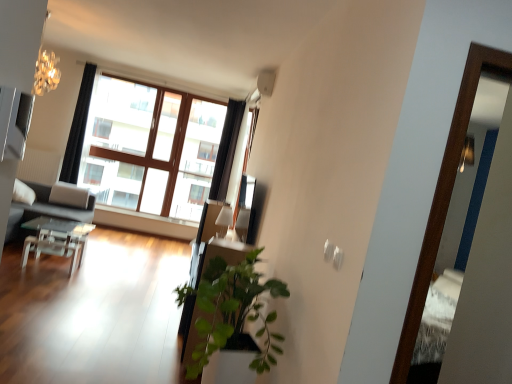
Locate an element on the screen. black fabric curtain at upper left, the 2th curtain positioned from the right is located at coordinates (x=78, y=127).

Identify the location of wooden screen door at right. The image size is (512, 384). (443, 198).

Where is `green leafy plant at center`? This screenshot has width=512, height=384. green leafy plant at center is located at coordinates (232, 312).

Image resolution: width=512 pixels, height=384 pixels. What do you see at coordinates (144, 222) in the screenshot?
I see `white painted wood at center` at bounding box center [144, 222].

The image size is (512, 384). What do you see at coordinates (148, 137) in the screenshot? I see `wooden window at center` at bounding box center [148, 137].

The image size is (512, 384). What do you see at coordinates (226, 150) in the screenshot?
I see `black fabric curtain at upper center, placed as the first curtain when sorted from right to left` at bounding box center [226, 150].

Find the location of a particular element. The image size is (512, 384). black fabric curtain at upper left, which appears as the 1th curtain when viewed from the left is located at coordinates (78, 127).

Which of these two, green leafy plant at center or wooden window at center, is thinner?

wooden window at center is thinner.

This screenshot has width=512, height=384. Find the location of `houseplant in front of the wooden window at center`. houseplant in front of the wooden window at center is located at coordinates (232, 312).

From the image's perspective, is green leafy plant at center located beneath wooden window at center?

Yes.

Is green leafy plant at center facing away from wooden window at center?

No, green leafy plant at center's orientation is not away from wooden window at center.

Are black fabric curtain at upper left, which appears as the 1th curtain when viewed from the left, and white painted wood at center far apart?

black fabric curtain at upper left, which appears as the 1th curtain when viewed from the left, is positioned a significant distance from white painted wood at center.

Considering their positions, is black fabric curtain at upper left, which appears as the 1th curtain when viewed from the left, located in front of or behind white painted wood at center?

black fabric curtain at upper left, which appears as the 1th curtain when viewed from the left, is positioned closer to the viewer than white painted wood at center.

Considering the relative sizes of black fabric curtain at upper left, the 2th curtain positioned from the right, and white painted wood at center in the image provided, is black fabric curtain at upper left, the 2th curtain positioned from the right, bigger than white painted wood at center?

Indeed, black fabric curtain at upper left, the 2th curtain positioned from the right, has a larger size compared to white painted wood at center.

Is black fabric curtain at upper left, the 2th curtain positioned from the right, surrounding white painted wood at center?

No, white painted wood at center is not surrounded by black fabric curtain at upper left, the 2th curtain positioned from the right.

Is green leafy plant at center at the left side of transparent glass table at lower left?

No, green leafy plant at center is not to the left of transparent glass table at lower left.

Which object is wider, green leafy plant at center or transparent glass table at lower left?

green leafy plant at center is wider.

From the image's perspective, between green leafy plant at center and transparent glass table at lower left, who is located below?

From the image's view, green leafy plant at center is below.

From a real-world perspective, which is physically above, green leafy plant at center or transparent glass table at lower left?

In real-world perspective, green leafy plant at center is above.

Which object is wider, wooden window at center or white painted wood at center?

With larger width is wooden window at center.

Is wooden window at center positioned with its back to white painted wood at center?

No.

Is wooden window at center shorter than white painted wood at center?

No, wooden window at center is not shorter than white painted wood at center.

Is wooden screen door at right wider than wooden window at center?

Incorrect, the width of wooden screen door at right does not surpass that of wooden window at center.

Is point (411, 347) positioned after point (120, 158)?

No, it is not.

How different are the orientations of wooden screen door at right and wooden window at center in degrees?

They differ by 2.53 degrees in their facing directions.

Is wooden screen door at right positioned with its back to wooden window at center?

wooden screen door at right does not have its back to wooden window at center.

From the image's perspective, relative to green leafy plant at center, is wooden window at center above or below?

From the image's perspective, wooden window at center appears above green leafy plant at center.

Is green leafy plant at center at the back of wooden window at center?

No, wooden window at center is not facing away from green leafy plant at center.

Based on the photo, considering the sizes of wooden window at center and green leafy plant at center in the image, is wooden window at center taller or shorter than green leafy plant at center?

In the image, wooden window at center appears to be taller than green leafy plant at center.

Looking at the image, does wooden window at center seem bigger or smaller compared to green leafy plant at center?

Clearly, wooden window at center is larger in size than green leafy plant at center.

Considering the sizes of objects matte gray couch at left and green leafy plant at center in the image provided, who is shorter, matte gray couch at left or green leafy plant at center?

matte gray couch at left.

From a real-world perspective, is matte gray couch at left on top of green leafy plant at center?

Incorrect, from a real-world perspective, matte gray couch at left is lower than green leafy plant at center.

Is matte gray couch at left touching green leafy plant at center?

matte gray couch at left is not next to green leafy plant at center, and they're not touching.

Is green leafy plant at center at the back of matte gray couch at left?

matte gray couch at left does not have its back to green leafy plant at center.

I want to click on window above the green leafy plant at center (from a real-world perspective), so click(x=148, y=137).

Find the location of `the 2nd curtain in front of the white painted wood at center`. the 2nd curtain in front of the white painted wood at center is located at coordinates (78, 127).

Which object lies further to the anchor point green leafy plant at center, matte gray couch at left or wooden screen door at right?

Among the two, matte gray couch at left is located further to green leafy plant at center.

Based on their spatial positions, is white painted wood at center or matte gray couch at left further from transparent glass table at lower left?

Among the two, white painted wood at center is located further to transparent glass table at lower left.

Based on their spatial positions, is green leafy plant at center or wooden screen door at right further from black fabric curtain at upper left, which appears as the 1th curtain when viewed from the left?

The object further to black fabric curtain at upper left, which appears as the 1th curtain when viewed from the left, is wooden screen door at right.

Considering their positions, is white painted wood at center positioned closer to matte gray couch at left than wooden window at center?

white painted wood at center is closer to matte gray couch at left.

Looking at the image, which one is located further to white painted wood at center, transparent glass table at lower left or wooden window at center?

transparent glass table at lower left.

Consider the image. When comparing their distances from white painted wood at center, does black fabric curtain at upper left, the 2th curtain positioned from the right, or black fabric curtain at upper center, placed as the first curtain when sorted from right to left, seem further?

black fabric curtain at upper left, the 2th curtain positioned from the right, is further to white painted wood at center.

Looking at the image, which one is located further to wooden screen door at right, green leafy plant at center or transparent glass table at lower left?

The object further to wooden screen door at right is transparent glass table at lower left.

Estimate the real-world distances between objects in this image. Which object is closer to wooden screen door at right, transparent glass table at lower left or wooden window at center?

transparent glass table at lower left.

I want to click on window situated between matte gray couch at left and black fabric curtain at upper center, placed as the first curtain when sorted from right to left, from left to right, so pos(148,137).

Find the location of a particular element. Image resolution: width=512 pixels, height=384 pixels. houseplant positioned between wooden screen door at right and wooden window at center from near to far is located at coordinates (232, 312).

In order to click on studio couch between green leafy plant at center and black fabric curtain at upper center, placed as the first curtain when sorted from right to left, along the z-axis in this screenshot , I will do `click(45, 211)`.

Find the location of a particular element. The width and height of the screenshot is (512, 384). curtain between transparent glass table at lower left and black fabric curtain at upper center, which is counted as the second curtain, starting from the left, along the z-axis is located at coordinates (78, 127).